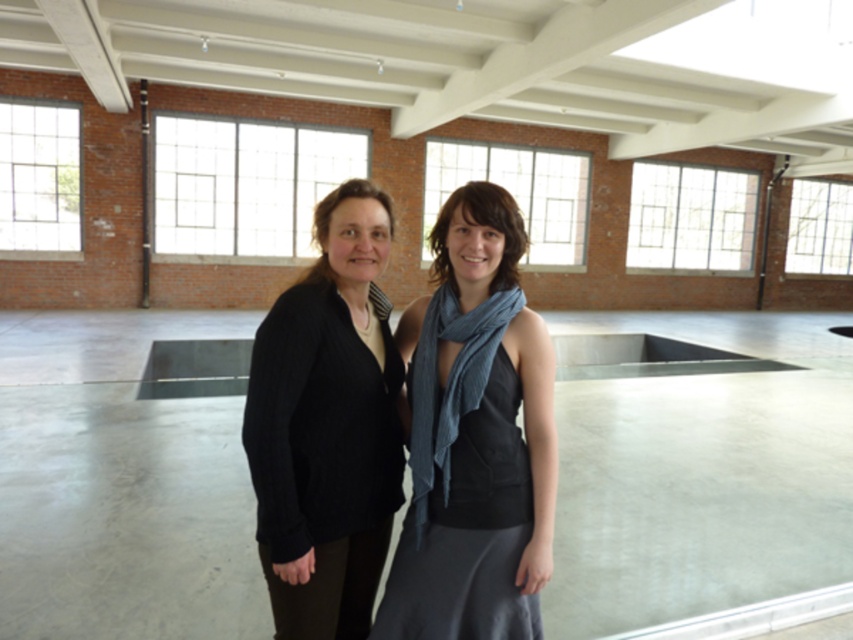
You are an interior designer assessing the space for safety. The rectangular cutout in the floor is directly behind the black knit sweater at center and blue textured scarf at center. If you want to place a large potted plant between these two items to block the view of the cutout, which object should the plant be closer to and why?

The plant should be placed closer to the black knit sweater at center because it is larger in size than the blue textured scarf at center, providing a better obstruction for the cutout.

You are standing at the origin point in the room. Where is the black knit sweater at center located in terms of coordinates?

The black knit sweater at center is located at coordinates point (x=328, y=426).